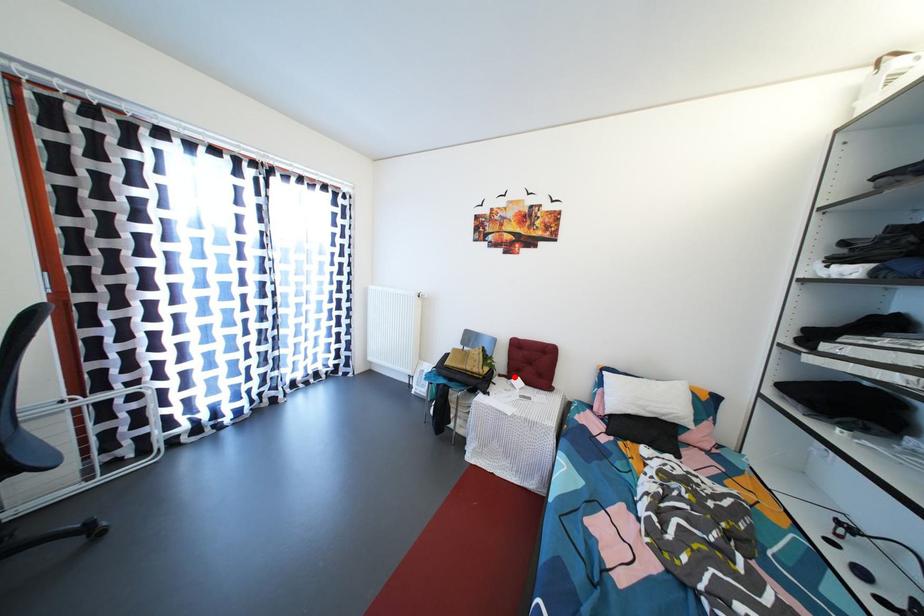
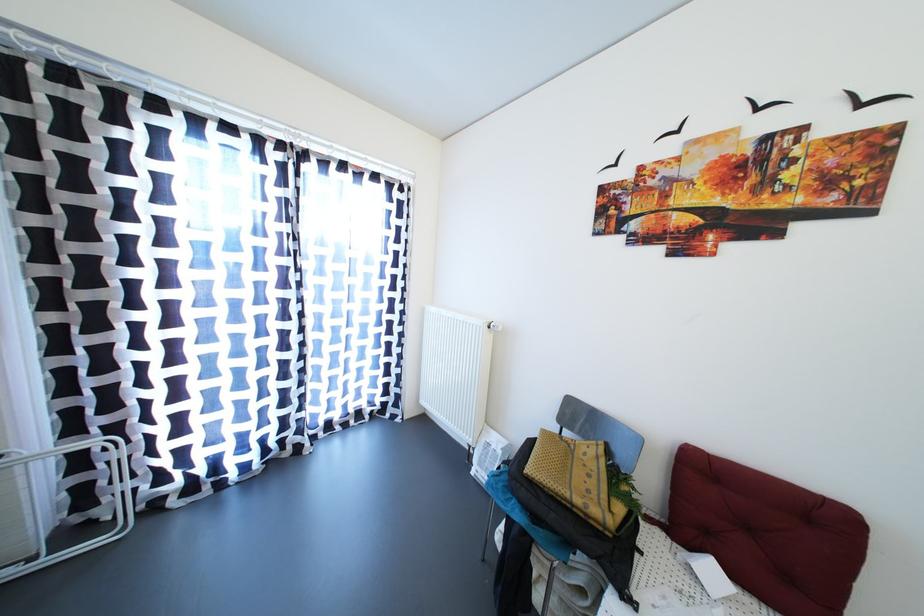
The point at the highlighted location is marked in the first image. Where is the corresponding point in the second image?

(677, 525)